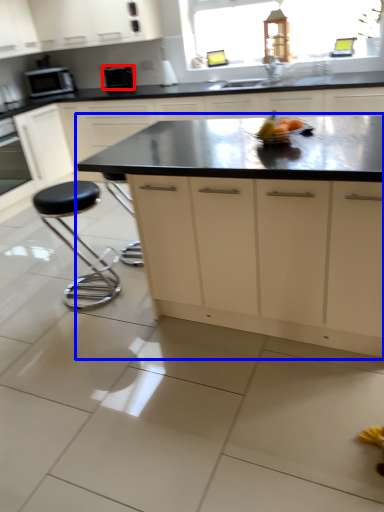
Question: Among these objects, which one is nearest to the camera, kitchen appliance (highlighted by a red box) or cabinetry (highlighted by a blue box)?

Choices:
 (A) kitchen appliance
 (B) cabinetry

Answer: (B)